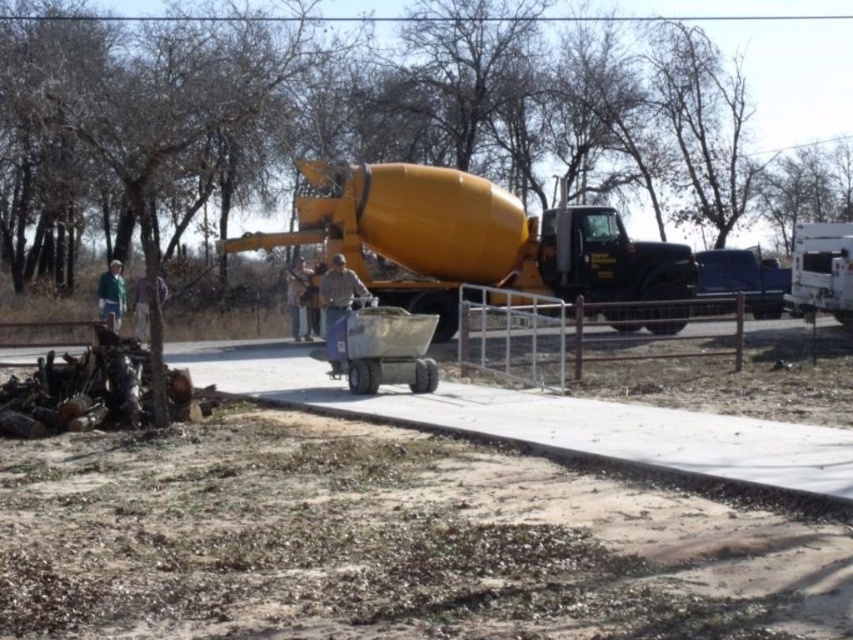
Question: Does smooth concrete sidewalk at center appear on the left side of green fabric jacket at left?

Choices:
 (A) yes
 (B) no

Answer: (B)

Question: Which point is closer to the camera?

Choices:
 (A) (332, 285)
 (B) (819, 291)

Answer: (A)

Question: Considering the relative positions of yellow matte concrete mixer at center and white glossy trailer truck at right in the image provided, where is yellow matte concrete mixer at center located with respect to white glossy trailer truck at right?

Choices:
 (A) left
 (B) right

Answer: (A)

Question: Can you confirm if yellow matte concrete mixer at center is positioned to the left of dark gray fabric jacket at center?

Choices:
 (A) yes
 (B) no

Answer: (B)

Question: Which of the following is the closest to the observer?

Choices:
 (A) yellow matte concrete mixer at center
 (B) camouflage jacket at center
 (C) white glossy trailer truck at right
 (D) tan fabric shirt at center

Answer: (B)

Question: Which point is closer to the camera?

Choices:
 (A) (137, 301)
 (B) (817, 308)
 (C) (120, 310)
 (D) (792, 600)

Answer: (D)